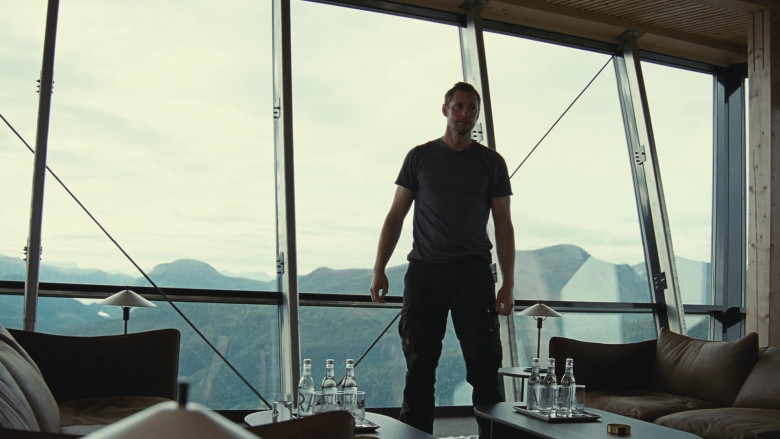
This screenshot has height=439, width=780. Find the location of `tables`. tables is located at coordinates (392, 423), (551, 428).